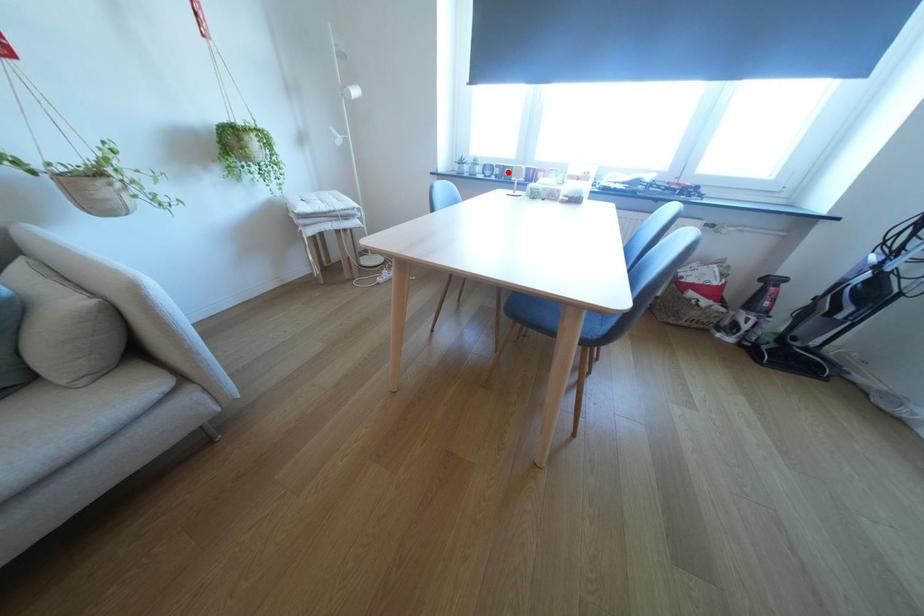
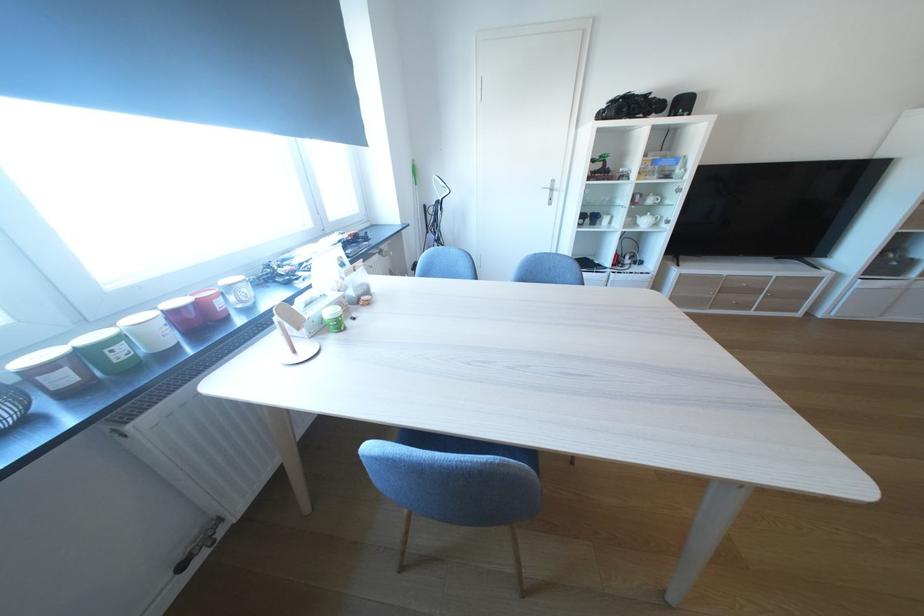
Question: I am providing you with two images of the same scene from different viewpoints. In image1, a red point is highlighted. Considering the same 3D point in image2, which of the following is correct?

Choices:
 (A) It is closer
 (B) It is farther

Answer: (B)